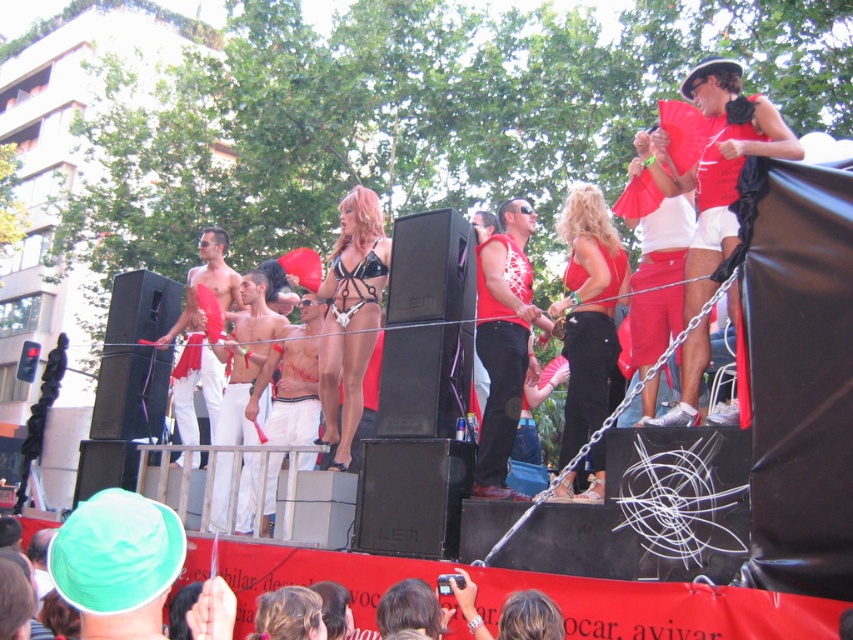
Does point (489, 413) lie behind point (225, 237)?

No, (489, 413) is closer to viewer.

Which is behind, point (514, 410) or point (213, 358)?

The point (213, 358) is more distant.

The width and height of the screenshot is (853, 640). Identify the location of matte red bikini at center. (503, 340).

Which is more to the right, matte red shorts at upper right or black leather bikini at center?

matte red shorts at upper right is more to the right.

Can you confirm if matte red shorts at upper right is positioned to the right of black leather bikini at center?

Indeed, matte red shorts at upper right is positioned on the right side of black leather bikini at center.

Who is more forward, (x=717, y=196) or (x=360, y=253)?

Positioned in front is point (x=717, y=196).

Locate an element on the screen. The height and width of the screenshot is (640, 853). matte red shorts at upper right is located at coordinates (718, 166).

Is matte white shorts at center positioned behind shiny white shorts at center?

No, it is in front of shiny white shorts at center.

Does point (264, 396) come farther from viewer compared to point (276, 406)?

Yes.

Between point (223, 474) and point (281, 401), which one is positioned behind?

Positioned behind is point (281, 401).

Locate an element on the screen. matte white shorts at center is located at coordinates (245, 358).